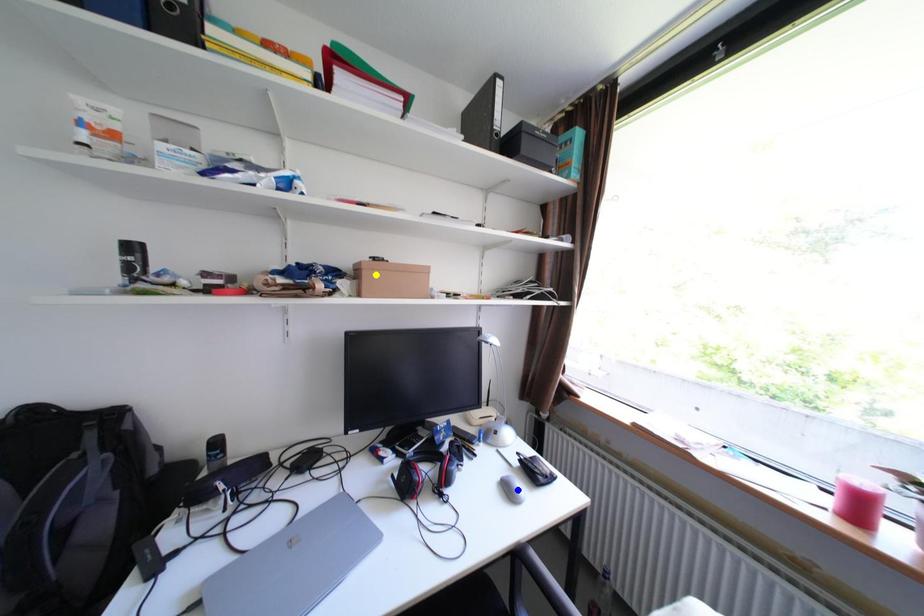
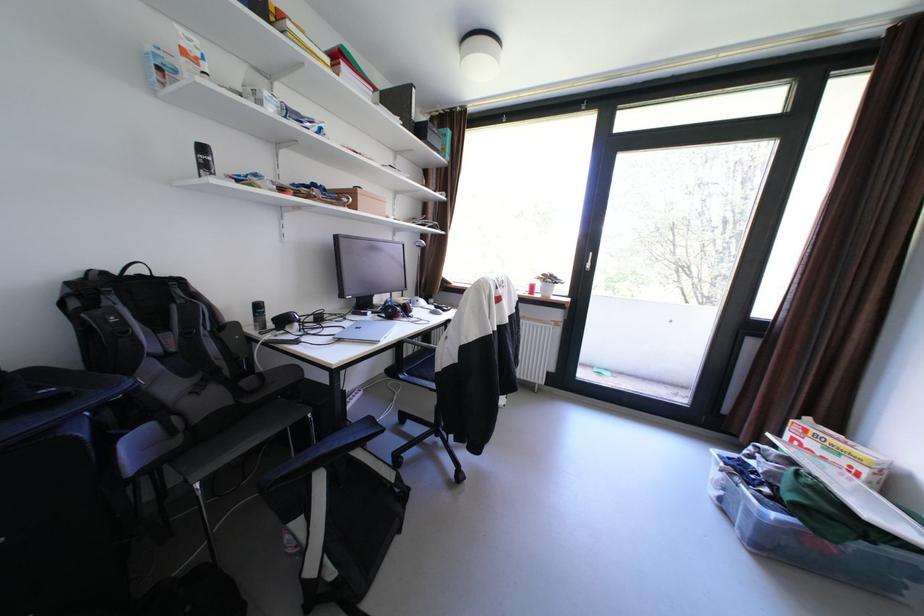
I am providing you with two images of the same scene from different viewpoints. Three points are marked in image1. Which point corresponds to a part or object that is occluded in image2?In image1, three points are marked. Which of them correspond to a part or object that is occluded in image2?Among the three points shown in image1, which one corresponds to a part or object that is no longer visible due to occlusion in image2?

green point, blue point cannot be seen in image2.